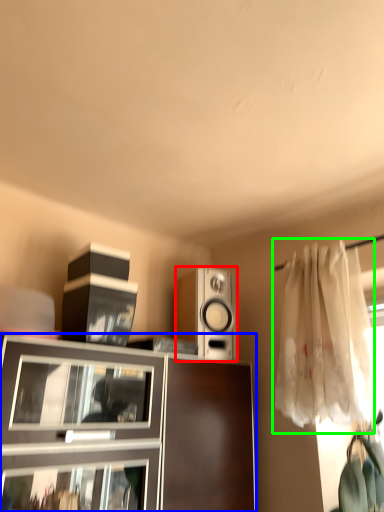
Question: Which object is the farthest from loudspeaker (highlighted by a red box)? Choose among these: cabinetry (highlighted by a blue box) or curtain (highlighted by a green box).

Choices:
 (A) cabinetry
 (B) curtain

Answer: (B)